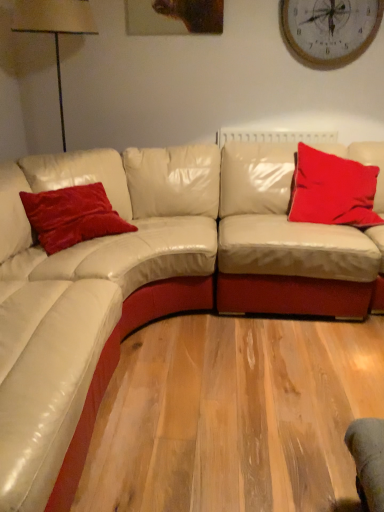
Question: Is wooden clock at upper center outside of white leather couch at center?

Choices:
 (A) no
 (B) yes

Answer: (B)

Question: From a real-world perspective, does wooden clock at upper center stand above white leather couch at center?

Choices:
 (A) yes
 (B) no

Answer: (A)

Question: From the image's perspective, is wooden clock at upper center above white leather couch at center?

Choices:
 (A) yes
 (B) no

Answer: (A)

Question: Is wooden clock at upper center beside white leather couch at center?

Choices:
 (A) no
 (B) yes

Answer: (A)

Question: Is the position of wooden clock at upper center less distant than that of white leather couch at center?

Choices:
 (A) yes
 (B) no

Answer: (B)

Question: Can you confirm if wooden clock at upper center is smaller than white leather couch at center?

Choices:
 (A) no
 (B) yes

Answer: (B)

Question: Is wooden clock at upper center oriented away from velvet red pillow at left, the 2th pillow when ordered from right to left?

Choices:
 (A) no
 (B) yes

Answer: (A)

Question: Is the surface of wooden clock at upper center in direct contact with velvet red pillow at left, which is the 1th pillow from left to right?

Choices:
 (A) yes
 (B) no

Answer: (B)

Question: Considering the relative sizes of wooden clock at upper center and velvet red pillow at left, the 2th pillow when ordered from right to left, in the image provided, is wooden clock at upper center smaller than velvet red pillow at left, the 2th pillow when ordered from right to left,?

Choices:
 (A) no
 (B) yes

Answer: (B)

Question: From a real-world perspective, is wooden clock at upper center positioned over velvet red pillow at left, which is the 1th pillow from left to right, based on gravity?

Choices:
 (A) no
 (B) yes

Answer: (B)

Question: Considering the relative sizes of wooden clock at upper center and velvet red pillow at left, which is the 1th pillow from left to right, in the image provided, is wooden clock at upper center wider than velvet red pillow at left, which is the 1th pillow from left to right,?

Choices:
 (A) yes
 (B) no

Answer: (B)

Question: From the image's perspective, is wooden clock at upper center under velvet red pillow at left, the 2th pillow when ordered from right to left?

Choices:
 (A) yes
 (B) no

Answer: (B)

Question: Considering the relative sizes of wooden clock at upper center and velvet red pillow at upper right, which is the second pillow in left-to-right order, in the image provided, is wooden clock at upper center smaller than velvet red pillow at upper right, which is the second pillow in left-to-right order,?

Choices:
 (A) yes
 (B) no

Answer: (A)